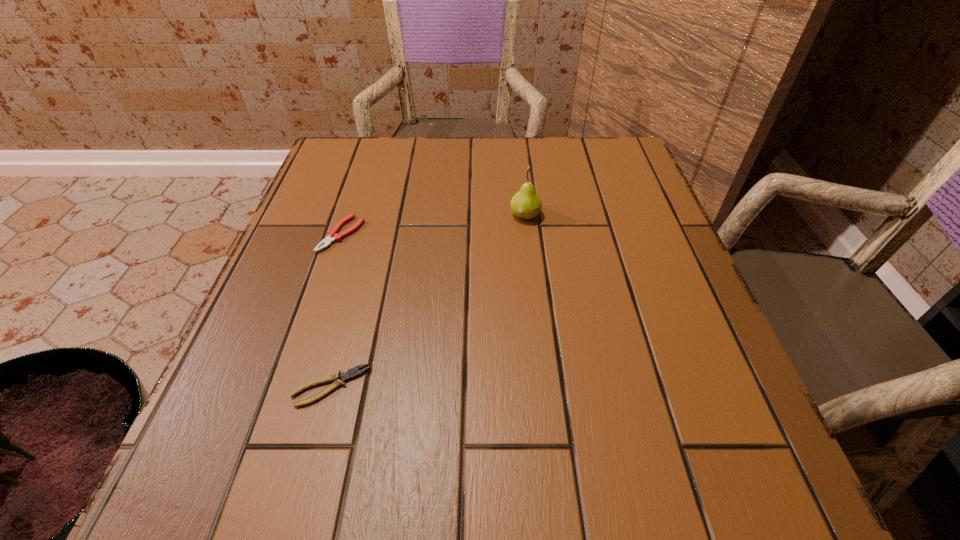
Identify the location of the rightmost object. (526, 204).

Where is `pear`? The height and width of the screenshot is (540, 960). pear is located at coordinates (526, 204).

Where is `the taller pliers`? This screenshot has height=540, width=960. the taller pliers is located at coordinates (332, 235).

Where is `the second tallest object`? the second tallest object is located at coordinates (332, 235).

Identify the location of the shortest object. tap(345, 376).

I want to click on the nearest object, so click(345, 376).

The image size is (960, 540). I want to click on vacant point located 0.100m on the front of the tallest object, so click(x=530, y=256).

At what (x,y) coordinates should I click in order to perform the action: click on free space located on the right of the taller pliers. Please return your answer as a coordinate pair (x, y). Looking at the image, I should click on (529, 234).

Locate an element on the screen. vacant space located on the back of the shortest object is located at coordinates (357, 287).

Identify the location of free space at the far edge. This screenshot has height=540, width=960. (472, 160).